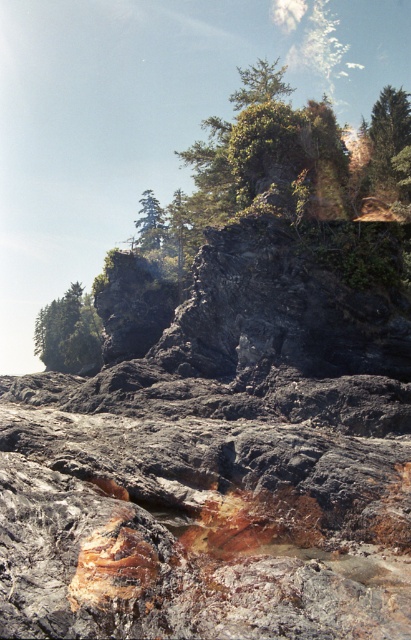
Question: Which of the following is the closest to the observer?

Choices:
 (A) green matte tree at upper right
 (B) green matte tree at upper center
 (C) green leafy tree at center
 (D) green matte tree at left

Answer: (C)

Question: Which of the following is the closest to the observer?

Choices:
 (A) green leafy tree at center
 (B) green matte tree at upper center

Answer: (A)

Question: Does green leafy tree at center appear under green matte tree at upper right?

Choices:
 (A) yes
 (B) no

Answer: (A)

Question: Which object is positioned closest to the green leafy tree at center?

Choices:
 (A) green matte tree at upper center
 (B) green matte tree at upper right

Answer: (A)

Question: Does green matte tree at upper right lie behind green matte tree at upper center?

Choices:
 (A) no
 (B) yes

Answer: (A)

Question: Can you confirm if green leafy tree at center is positioned above green matte tree at upper center?

Choices:
 (A) no
 (B) yes

Answer: (B)